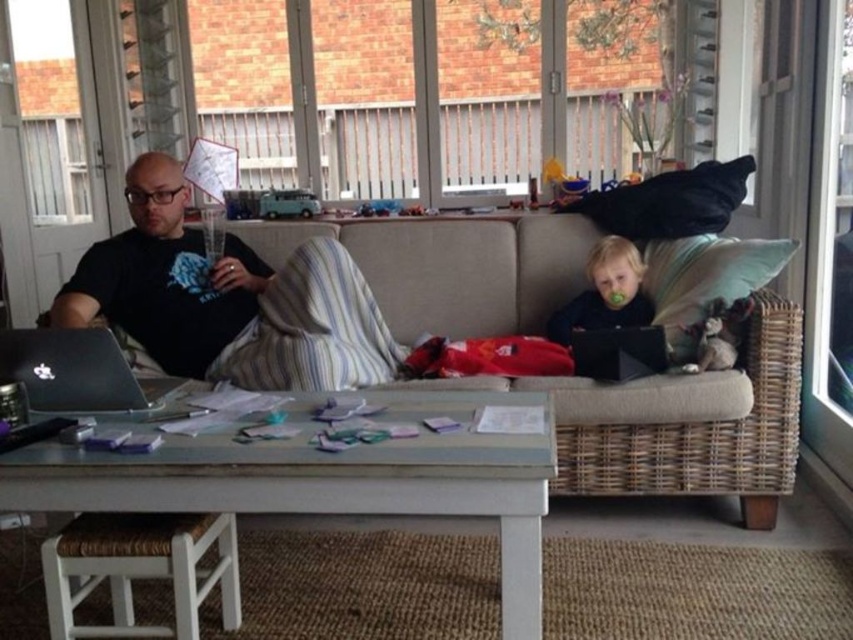
Question: Which object is the closest to the black matte laptop at right?

Choices:
 (A) matte black laptop at right
 (B) beige fabric couch at center
 (C) black glossy laptop at left

Answer: (B)

Question: Is beige fabric couch at center below black matte laptop at right?

Choices:
 (A) yes
 (B) no

Answer: (B)

Question: Considering the real-world distances, which object is farthest from the matte black laptop at right?

Choices:
 (A) beige fabric couch at center
 (B) black matte laptop at right
 (C) black glossy laptop at left

Answer: (C)

Question: Considering the relative positions of matte black laptop at right and black matte laptop at right in the image provided, where is matte black laptop at right located with respect to black matte laptop at right?

Choices:
 (A) below
 (B) above

Answer: (B)

Question: Which object is farther from the camera taking this photo?

Choices:
 (A) black matte laptop at right
 (B) beige fabric couch at center

Answer: (A)

Question: In this image, where is black matte laptop at left located relative to black matte laptop at right?

Choices:
 (A) right
 (B) left

Answer: (B)